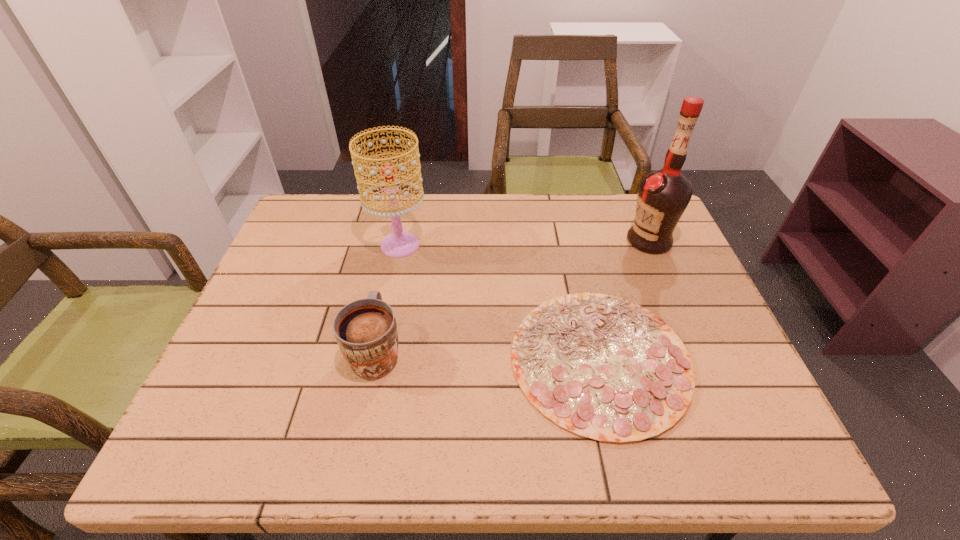
Where is `vacant space at the left edge of the desktop`? This screenshot has width=960, height=540. vacant space at the left edge of the desktop is located at coordinates (264, 302).

Image resolution: width=960 pixels, height=540 pixels. In order to click on vacant space at the right edge of the desktop in this screenshot , I will do `click(695, 343)`.

Find the location of a particular element. blank space at the far left corner of the desktop is located at coordinates (320, 210).

Identify the location of free space between the third shortest object and the shortest object. The image size is (960, 540). (499, 302).

Locate an element on the screen. The width and height of the screenshot is (960, 540). unoccupied area between the lampshade and the liquor is located at coordinates (524, 242).

The width and height of the screenshot is (960, 540). I want to click on free space between the liquor and the mug, so click(513, 295).

The width and height of the screenshot is (960, 540). I want to click on unoccupied position between the shortest object and the lampshade, so click(499, 302).

The image size is (960, 540). What are the coordinates of `empty space between the pizza and the lampshade` in the screenshot? It's located at (499, 302).

This screenshot has width=960, height=540. What are the coordinates of `free spot between the shortest object and the second tallest object` in the screenshot? It's located at tap(499, 302).

You are a GUI agent. You are given a task and a screenshot of the screen. Output one action in this format:
    pyautogui.click(x=<x>, y=<y>)
    Task: Click on the free space that is in between the lampshade and the mug
    
    Given the screenshot: What is the action you would take?
    pyautogui.click(x=389, y=298)